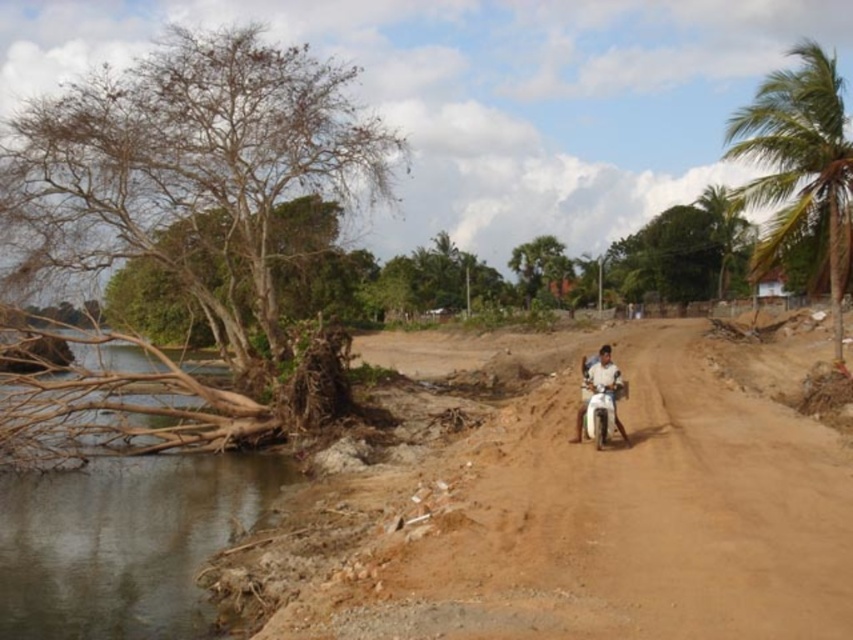
Between brown dry wood at left and white matte motorcycle at center, which one has more height?

brown dry wood at left is taller.

The image size is (853, 640). I want to click on brown dry wood at left, so click(x=187, y=170).

Is point (849, 147) farther from viewer compared to point (538, 243)?

No, (849, 147) is in front of (538, 243).

Where is `green leafy palm tree at right`? green leafy palm tree at right is located at coordinates (798, 164).

Locate an element on the screen. The height and width of the screenshot is (640, 853). green leafy palm tree at right is located at coordinates (798, 164).

Consider the image. Who is more forward, (334,602) or (33,403)?

Point (334,602) is in front.

Which of these two, brown sandy dirt track at center or brown dry wood at left, stands shorter?

brown sandy dirt track at center is shorter.

Does point (845, 586) come behind point (173, 192)?

No.

The height and width of the screenshot is (640, 853). I want to click on brown sandy dirt track at center, so click(613, 522).